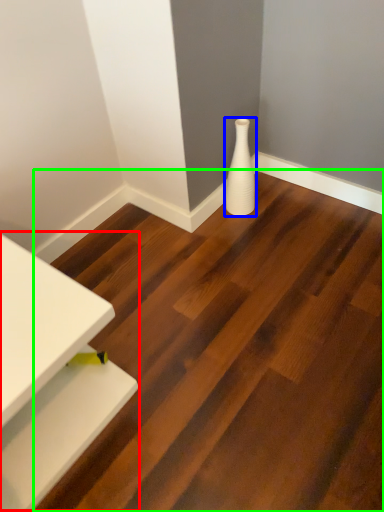
Question: Which object is positioned farthest from table (highlighted by a red box)? Select from vase (highlighted by a blue box) and stair (highlighted by a green box).

Choices:
 (A) vase
 (B) stair

Answer: (A)